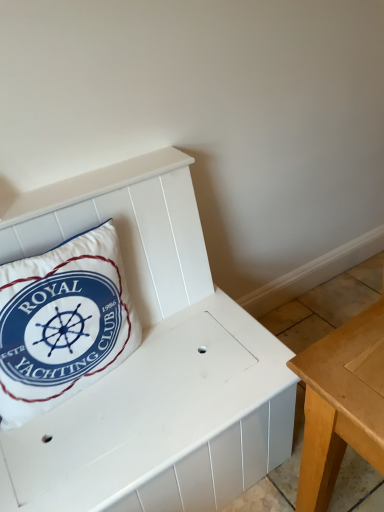
Question: Relative to white fabric pillow at left, is white matte bench at center in front or behind?

Choices:
 (A) front
 (B) behind

Answer: (A)

Question: Would you say white matte bench at center is to the left or to the right of white fabric pillow at left in the picture?

Choices:
 (A) left
 (B) right

Answer: (B)

Question: Does point (129, 260) appear closer or farther from the camera than point (92, 231)?

Choices:
 (A) farther
 (B) closer

Answer: (A)

Question: Is white fabric pillow at left situated inside white matte bench at center or outside?

Choices:
 (A) outside
 (B) inside

Answer: (A)

Question: In terms of size, does white fabric pillow at left appear bigger or smaller than white matte bench at center?

Choices:
 (A) big
 (B) small

Answer: (B)

Question: From the image's perspective, is white fabric pillow at left positioned above or below white matte bench at center?

Choices:
 (A) above
 (B) below

Answer: (A)

Question: Looking at their shapes, would you say white fabric pillow at left is wider or thinner than white matte bench at center?

Choices:
 (A) thin
 (B) wide

Answer: (A)